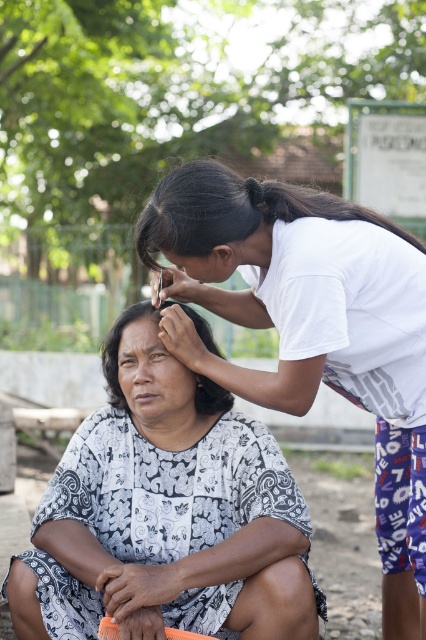
Question: Which point is farther from the camera taking this photo?

Choices:
 (A) (109, 353)
 (B) (218, 228)
 (C) (204, 410)

Answer: (A)

Question: Is white printed fabric at lower left positioned at the back of matte black forehead at center?

Choices:
 (A) no
 (B) yes

Answer: (A)

Question: Considering the relative positions of black silky hair at upper center and white patterned hair at center in the image provided, where is black silky hair at upper center located with respect to white patterned hair at center?

Choices:
 (A) below
 (B) above

Answer: (B)

Question: Does white printed fabric at lower left appear on the right side of matte black forehead at center?

Choices:
 (A) yes
 (B) no

Answer: (A)

Question: Among these points, which one is farthest from the camera?

Choices:
 (A) (204, 636)
 (B) (201, 396)

Answer: (B)

Question: Among these points, which one is farthest from the camera?

Choices:
 (A) (103, 634)
 (B) (195, 387)
 (C) (147, 321)
 (D) (187, 164)

Answer: (C)